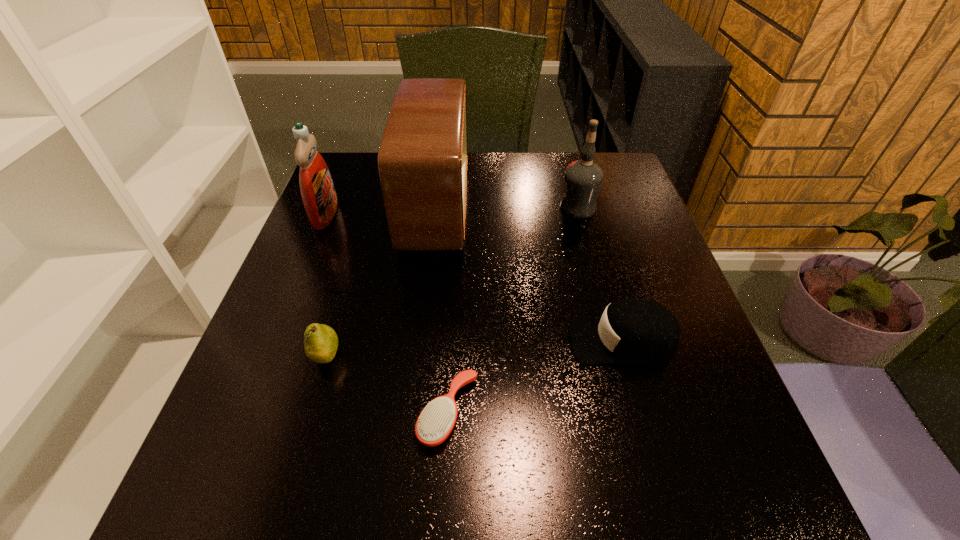
You are a GUI agent. You are given a task and a screenshot of the screen. Output one action in this format:
    pyautogui.click(x=<x>, y=<y>)
    Task: Click on the free space located on the front label of the vodka
    
    Given the screenshot: What is the action you would take?
    pyautogui.click(x=464, y=208)

This screenshot has height=540, width=960. Find the location of `vacant region located 0.200m on the front label of the vodka`. vacant region located 0.200m on the front label of the vodka is located at coordinates (483, 208).

Locate an element on the screen. This screenshot has height=540, width=960. vacant space located 0.080m on the back of the second object from left to right is located at coordinates (340, 310).

Find the location of a particular element. Image resolution: width=960 pixels, height=540 pixels. blank area located 0.370m on the front-facing side of the cap is located at coordinates (377, 341).

Identify the location of blank space located 0.300m on the front-facing side of the cap. (414, 341).

Find the location of a particular element. The width and height of the screenshot is (960, 540). vacant space located 0.180m on the front-facing side of the cap is located at coordinates (476, 341).

The width and height of the screenshot is (960, 540). Identify the location of vacant space located on the left of the shortest object. click(324, 413).

Find the location of `radio receiver positioned at the far edge`. radio receiver positioned at the far edge is located at coordinates (422, 161).

Where is `vodka that is positioned at the far edge`? vodka that is positioned at the far edge is located at coordinates (583, 178).

I want to click on detergent that is at the left edge, so click(x=317, y=189).